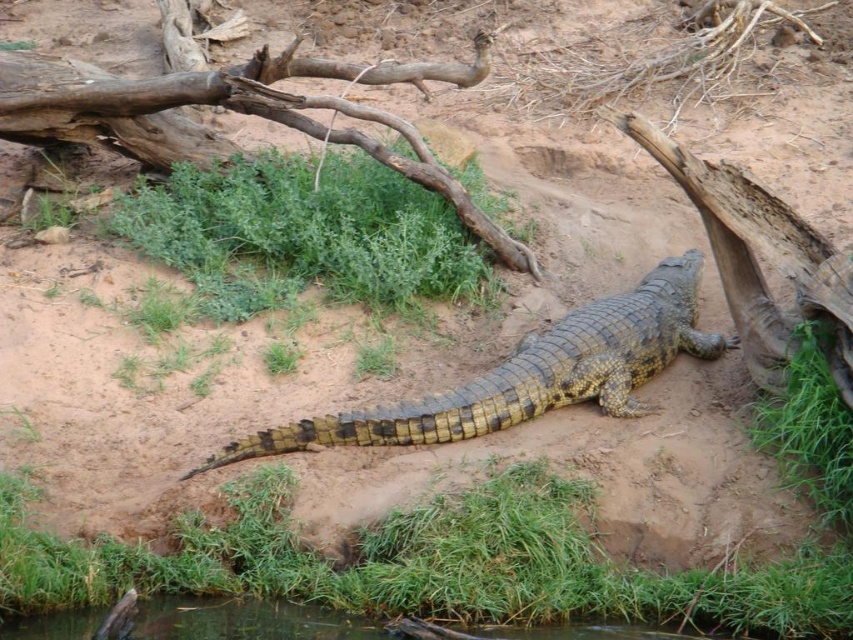
Is point (529, 388) closer to viewer compared to point (276, 616)?

No, (529, 388) is further to viewer.

Locate an element on the screen. This screenshot has width=853, height=640. yellow-green scaly crocodile at center is located at coordinates (529, 374).

Does point (430, 412) come behind point (12, 632)?

Yes.

I want to click on yellow-green scaly crocodile at center, so click(529, 374).